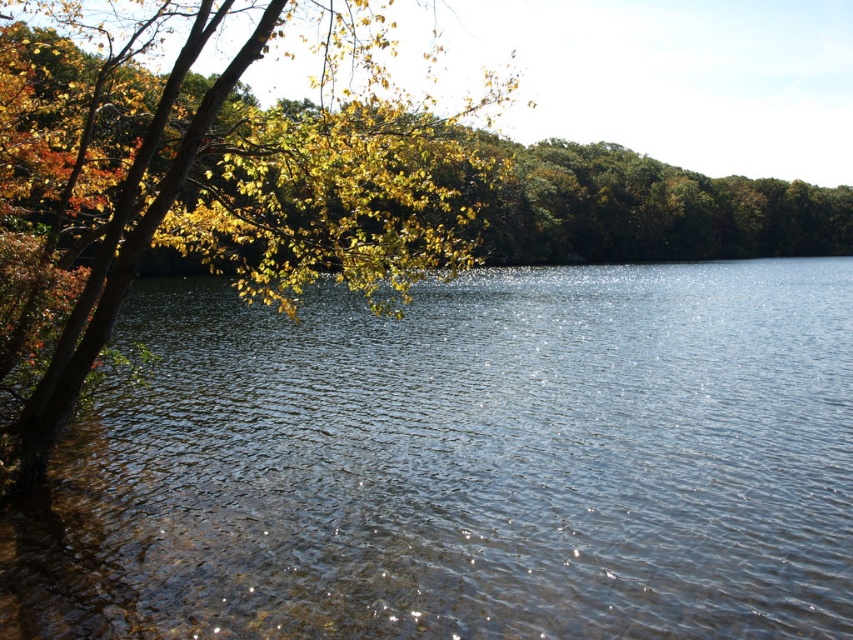
Does clear water at center have a lesser width compared to yellow-green leaves at left?

No.

Does clear water at center have a smaller size compared to yellow-green leaves at left?

Indeed, clear water at center has a smaller size compared to yellow-green leaves at left.

Which is behind, point (428, 579) or point (350, 96)?

The point (350, 96) is more distant.

Identify the location of clear water at center. (463, 465).